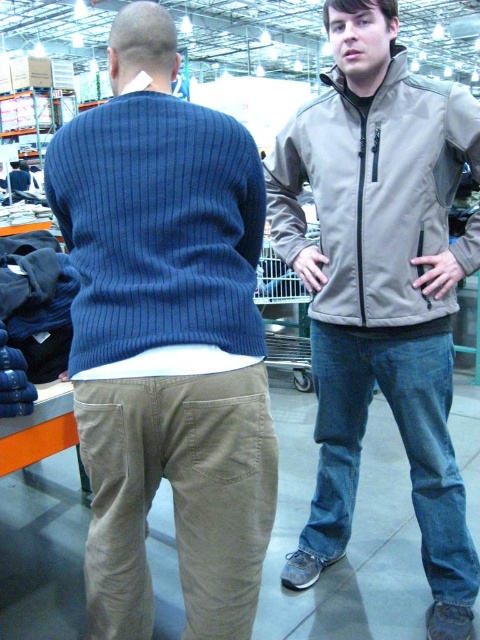
Is ribbed knit sweater at back positioned behind metallic silver shopping cart at center?

No, it is not.

Measure the distance from ribbed knit sweater at back to metallic silver shopping cart at center.

ribbed knit sweater at back and metallic silver shopping cart at center are 2.55 meters apart.

Is point (204, 484) positioned in front of point (275, 298)?

Yes, point (204, 484) is closer to viewer.

This screenshot has height=640, width=480. Identify the location of ribbed knit sweater at back. (166, 339).

Who is higher up, matte khaki pants at center or ribbed blue sweater at back?

ribbed blue sweater at back is above.

Which is behind, point (465, 536) or point (154, 300)?

Point (465, 536)

From the picture: Measure the distance between point (332, 38) and camera.

The distance of point (332, 38) from camera is 1.56 meters.

Image resolution: width=480 pixels, height=640 pixels. Find the location of `matte khaki pants at center`. matte khaki pants at center is located at coordinates (381, 288).

Can you confirm if khaki cotton pants at back is shorter than tan softshell jacket at upper right?

Correct, khaki cotton pants at back is not as tall as tan softshell jacket at upper right.

Can you confirm if khaki cotton pants at back is thinner than tan softshell jacket at upper right?

Yes, khaki cotton pants at back is thinner than tan softshell jacket at upper right.

Who is more forward, (210, 476) or (338, 284)?

Positioned in front is point (210, 476).

You are a GUI agent. You are given a task and a screenshot of the screen. Output one action in this format:
    pyautogui.click(x=<x>, y=<y>)
    Task: Click on the khaki cotton pants at back
    This screenshot has width=480, height=640.
    Given the screenshot: What is the action you would take?
    pyautogui.click(x=178, y=497)